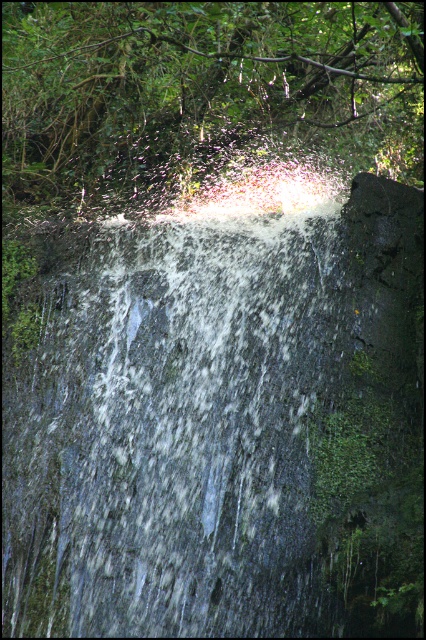
Who is lower down, translucent glass waterfall at center or green leafy tree at upper center?

translucent glass waterfall at center is lower down.

Is point (365, 588) behind point (245, 120)?

No, it is in front of (245, 120).

This screenshot has width=426, height=640. Find the location of `translucent glass waterfall at center`. translucent glass waterfall at center is located at coordinates [x=218, y=422].

You are a GUI agent. You are given a task and a screenshot of the screen. Output one action in this format:
    pyautogui.click(x=<x>, y=<y>)
    Task: Click on the translucent glass waterfall at center
    Image resolution: width=426 pixels, height=640 pixels.
    Given the screenshot: What is the action you would take?
    pyautogui.click(x=218, y=422)